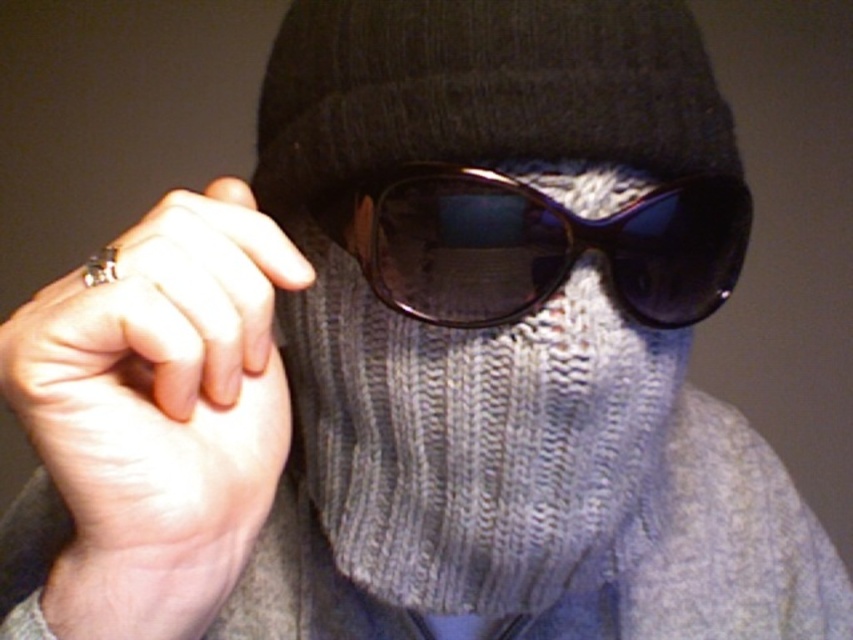
You are an artist sketching this scene. You need to draw the point at position point (650, 337) and point (488, 301). Which point should you draw first to ensure proper layering?

Point (488, 301) should be drawn first because it is in front of point (650, 337), which is behind it.

You are designing a display case for a fashion exhibition. The case must accommodate both the knitted gray scarf at center and the sunglasses at center. Given their sizes, which item should be placed in a wider section of the case?

The sunglasses at center should be placed in the wider section of the case since the knitted gray scarf at center has a lesser width compared to sunglasses at center.

You are a fashion designer trying to create a cohesive look for a winter collection. You have a knitted gray scarf at center and a silver metallic ring at left. Given their positions, can the ring be worn with the scarf in a way that they complement each other visually without overlapping?

The knitted gray scarf at center is 9.23 centimeters away from the silver metallic ring at left, so yes, the ring can be worn with the scarf in a way that they complement each other visually without overlapping since there is sufficient space between them.